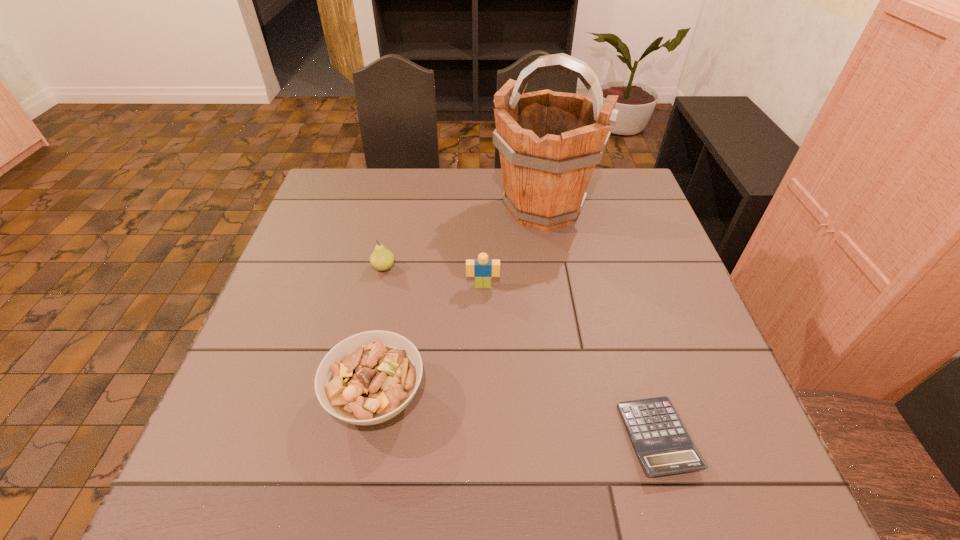
Image resolution: width=960 pixels, height=540 pixels. What are the coordinates of `free space at the right edge` in the screenshot? It's located at (650, 244).

You are a GUI agent. You are given a task and a screenshot of the screen. Output one action in this format:
    pyautogui.click(x=<x>, y=<y>)
    Task: Click on the vacant region at the near left corner of the desktop
    This screenshot has height=540, width=960.
    Given the screenshot: What is the action you would take?
    click(288, 465)

Locate an element on the screen. The height and width of the screenshot is (540, 960). vacant area at the far right corner is located at coordinates (622, 207).

Locate an element on the screen. This screenshot has width=960, height=540. empty location between the tallest object and the fourth nearest object is located at coordinates (464, 238).

Locate an element on the screen. This screenshot has width=960, height=540. blank region between the shortest object and the farthest object is located at coordinates (600, 322).

This screenshot has height=540, width=960. I want to click on vacant area that lies between the third nearest object and the calculator, so click(570, 361).

The height and width of the screenshot is (540, 960). I want to click on blank region between the Lego and the fourth nearest object, so click(x=433, y=276).

Image resolution: width=960 pixels, height=540 pixels. In order to click on empty space that is in between the shortest object and the Lego in this screenshot , I will do `click(570, 361)`.

I want to click on vacant point located between the calculator and the tallest object, so click(x=600, y=322).

This screenshot has width=960, height=540. I want to click on empty location between the second farthest object and the calculator, so point(520,352).